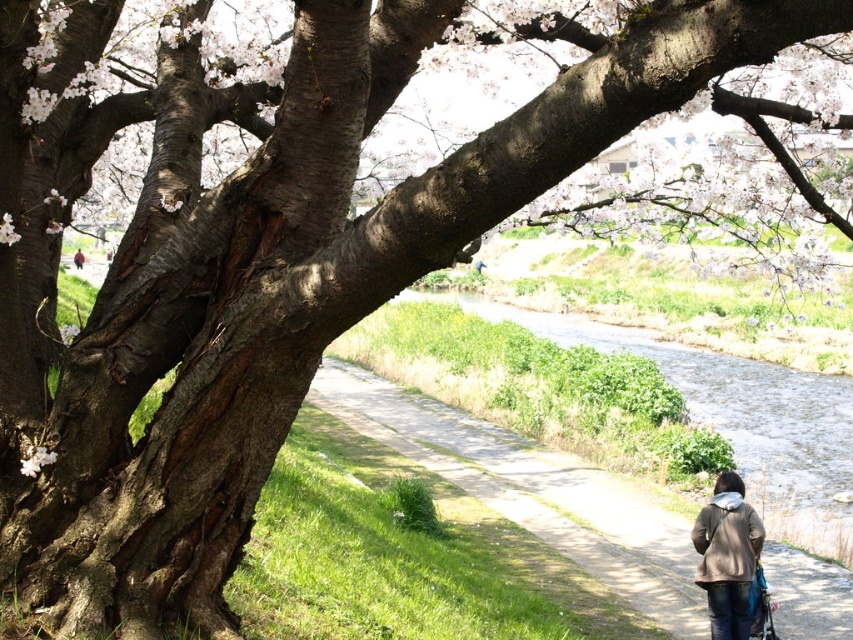
Between green grassy pavement at lower center and brown textured jacket at lower right, which one appears on the right side from the viewer's perspective?

brown textured jacket at lower right

Looking at this image, does green grassy pavement at lower center lie behind brown textured jacket at lower right?

Yes, green grassy pavement at lower center is behind brown textured jacket at lower right.

At what (x,y) coordinates should I click in order to perform the action: click on green grassy pavement at lower center. Please return your answer as a coordinate pair (x, y). Looking at the image, I should click on [x=534, y=492].

Find the location of a particular element. This screenshot has height=640, width=853. green grassy pavement at lower center is located at coordinates (534, 492).